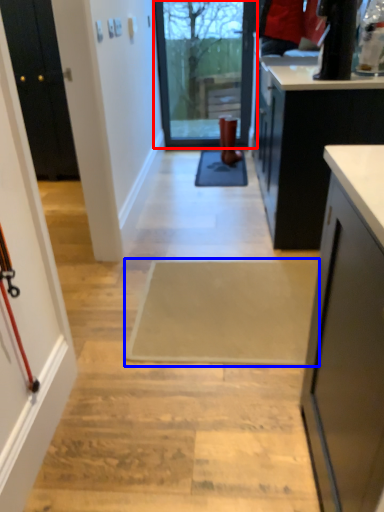
Question: Which object appears closest to the camera in this image, glass door (highlighted by a red box) or doormat (highlighted by a blue box)?

Choices:
 (A) glass door
 (B) doormat

Answer: (B)